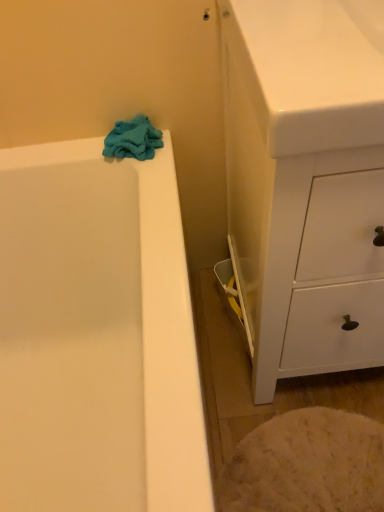
What is the approximate height of white matte cabinet at right?

white matte cabinet at right is 35.26 inches in height.

The width and height of the screenshot is (384, 512). Describe the element at coordinates (304, 185) in the screenshot. I see `white matte cabinet at right` at that location.

Where is `white matte cabinet at right`? white matte cabinet at right is located at coordinates (304, 185).

Locate an element on the screen. The height and width of the screenshot is (512, 384). teal soft towel at upper left is located at coordinates (133, 139).

Measure the distance between point (157,146) and camera.

They are 37.09 inches apart.

What do you see at coordinates (133, 139) in the screenshot?
I see `teal soft towel at upper left` at bounding box center [133, 139].

What is the approximate height of teal soft towel at upper left?

teal soft towel at upper left is 2.89 inches tall.

Image resolution: width=384 pixels, height=512 pixels. I want to click on white matte cabinet at right, so click(304, 185).

Which is more to the right, white matte cabinet at right or teal soft towel at upper left?

From the viewer's perspective, white matte cabinet at right appears more on the right side.

Which object is more forward, white matte cabinet at right or teal soft towel at upper left?

white matte cabinet at right is more forward.

Is point (254, 286) positioned in front of point (141, 140)?

Yes.

From the image's perspective, which is above, white matte cabinet at right or teal soft towel at upper left?

teal soft towel at upper left.

From a real-world perspective, is white matte cabinet at right located higher than teal soft towel at upper left?

Incorrect, from a real-world perspective, white matte cabinet at right is lower than teal soft towel at upper left.

Which of these two, white matte cabinet at right or teal soft towel at upper left, is wider?

Wider between the two is white matte cabinet at right.

Does white matte cabinet at right have a greater height compared to teal soft towel at upper left?

Yes.

Does white matte cabinet at right have a smaller size compared to teal soft towel at upper left?

Actually, white matte cabinet at right might be larger than teal soft towel at upper left.

Can teal soft towel at upper left be found inside white matte cabinet at right?

No, teal soft towel at upper left is not inside white matte cabinet at right.

Is the surface of white matte cabinet at right in direct contact with teal soft towel at upper left?

white matte cabinet at right and teal soft towel at upper left are not in contact.

Is white matte cabinet at right facing towards teal soft towel at upper left?

No, white matte cabinet at right is not aimed at teal soft towel at upper left.

In order to click on bath towel on the left of white matte cabinet at right in this screenshot , I will do `click(133, 139)`.

Is teal soft towel at upper left at the left side of white matte cabinet at right?

Yes, teal soft towel at upper left is to the left of white matte cabinet at right.

Does teal soft towel at upper left lie in front of white matte cabinet at right?

No, teal soft towel at upper left is behind white matte cabinet at right.

Does point (142, 124) come in front of point (311, 8)?

That is False.

From the image's perspective, is teal soft towel at upper left on top of white matte cabinet at right?

Yes, from the image's perspective, teal soft towel at upper left is over white matte cabinet at right.

From a real-world perspective, is teal soft towel at upper left under white matte cabinet at right?

No, from a real-world perspective, teal soft towel at upper left is not under white matte cabinet at right.

Between teal soft towel at upper left and white matte cabinet at right, which one has larger width?

white matte cabinet at right is wider.

From the picture: Does teal soft towel at upper left have a lesser height compared to white matte cabinet at right?

Correct, teal soft towel at upper left is not as tall as white matte cabinet at right.

Which of these two, teal soft towel at upper left or white matte cabinet at right, is bigger?

With larger size is white matte cabinet at right.

Is white matte cabinet at right a part of teal soft towel at upper left?

Definitely not — white matte cabinet at right is not inside teal soft towel at upper left.

Is teal soft towel at upper left positioned far away from white matte cabinet at right?

No, there isn't a large distance between teal soft towel at upper left and white matte cabinet at right.

Is teal soft towel at upper left facing away from white matte cabinet at right?

No.

What's the angular difference between teal soft towel at upper left and white matte cabinet at right's facing directions?

1.53 degrees separate the facing orientations of teal soft towel at upper left and white matte cabinet at right.

Locate an element on the screen. chest of drawers below the teal soft towel at upper left (from a real-world perspective) is located at coordinates (304, 185).

The height and width of the screenshot is (512, 384). I want to click on bath towel lying behind the white matte cabinet at right, so click(x=133, y=139).

Image resolution: width=384 pixels, height=512 pixels. Identify the location of bath towel above the white matte cabinet at right (from the image's perspective). (133, 139).